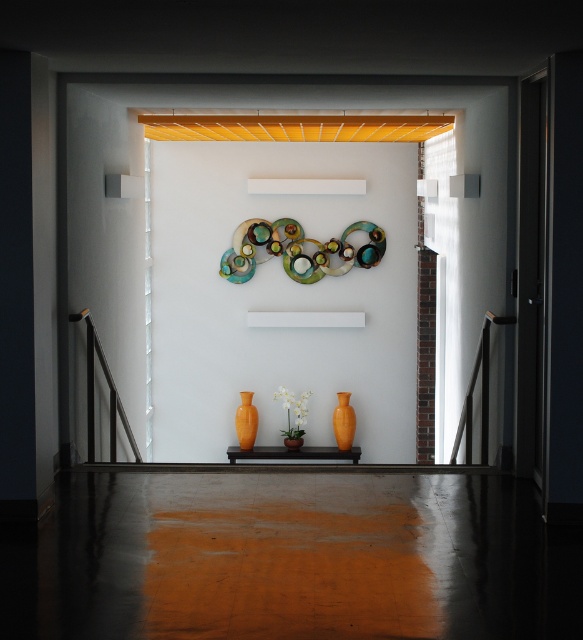
Who is lower down, orange glossy vase at center or orange matte vase at center?

orange glossy vase at center is below.

Is orange glossy vase at center to the left of orange matte vase at center from the viewer's perspective?

In fact, orange glossy vase at center is to the right of orange matte vase at center.

Where is `orange glossy vase at center`? This screenshot has width=583, height=640. orange glossy vase at center is located at coordinates (343, 420).

The image size is (583, 640). What are the coordinates of `orange glossy vase at center` in the screenshot? It's located at (343, 420).

Where is `metallic multicolored circular shapes at upper center`? The width and height of the screenshot is (583, 640). metallic multicolored circular shapes at upper center is located at coordinates (297, 250).

The width and height of the screenshot is (583, 640). In order to click on metallic multicolored circular shapes at upper center in this screenshot , I will do [x=297, y=250].

Is metallic multicolored circular shapes at upper center bigger than orange matte vase at center?

Yes, metallic multicolored circular shapes at upper center is bigger than orange matte vase at center.

Does metallic multicolored circular shapes at upper center have a greater height compared to orange matte vase at center?

Indeed, metallic multicolored circular shapes at upper center has a greater height compared to orange matte vase at center.

Does point (300, 241) lie in front of point (252, 442)?

Yes, it is in front of point (252, 442).

Find the location of `metallic multicolored circular shapes at upper center`. metallic multicolored circular shapes at upper center is located at coordinates (297, 250).